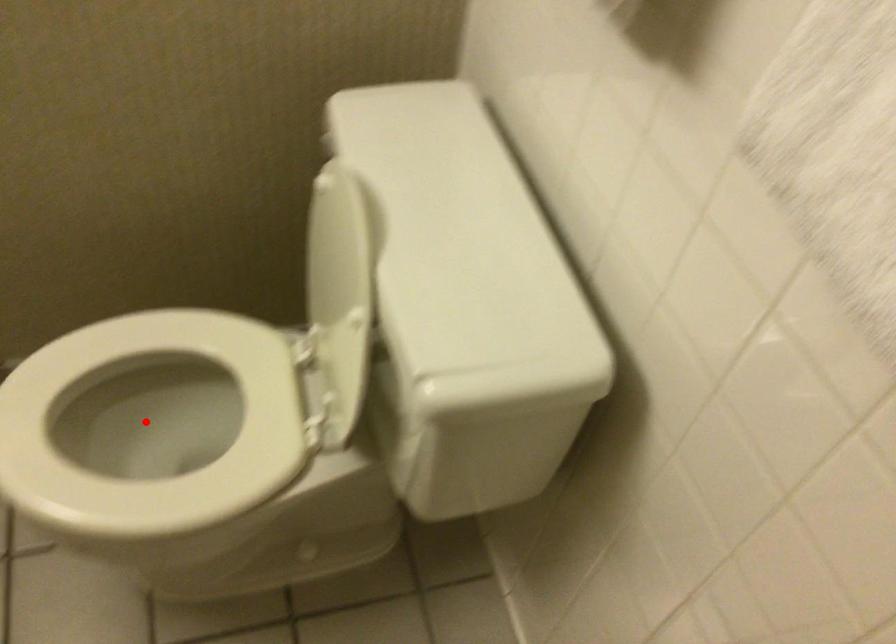
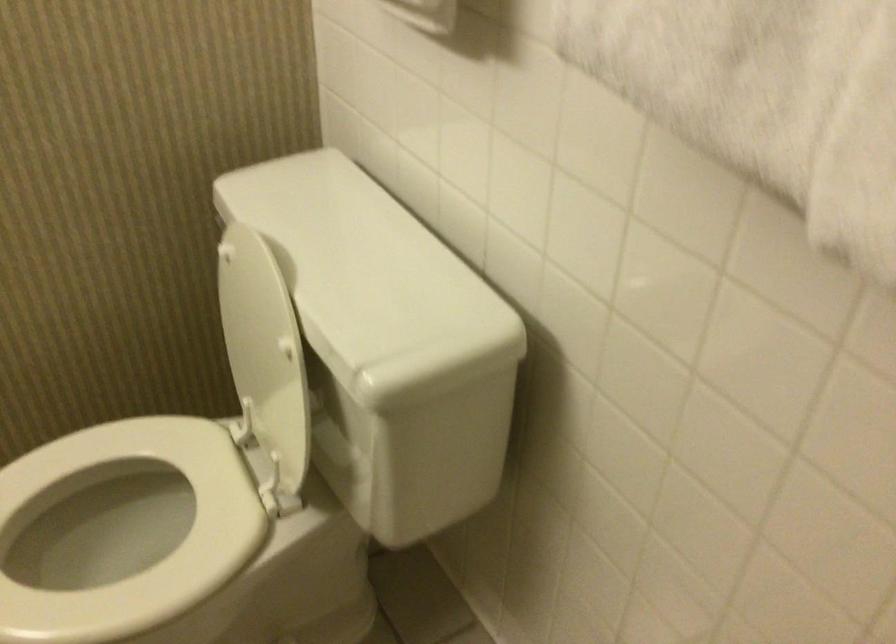
Locate, in the second image, the point that corresponds to the highlighted location in the first image.

(97, 545)